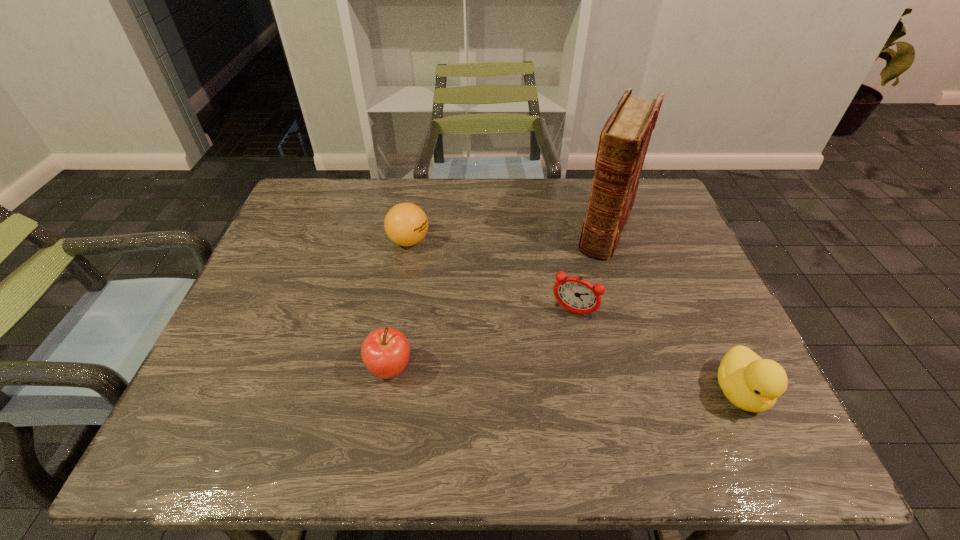
Identify which object is located as the second nearest to the apple. Please provide its 2D coordinates. Your answer should be formatted as a tuple, i.e. [(x, y)], where the tuple contains the x and y coordinates of a point satisfying the conditions above.

[(576, 295)]

Where is `free region that satisfies the following two spatial constraints: 1. on the back side of the tallest object; 2. on the left side of the apple`? Image resolution: width=960 pixels, height=540 pixels. free region that satisfies the following two spatial constraints: 1. on the back side of the tallest object; 2. on the left side of the apple is located at coordinates (414, 228).

I want to click on free location that satisfies the following two spatial constraints: 1. on the back side of the hardback book; 2. on the right side of the third farthest object, so click(x=557, y=228).